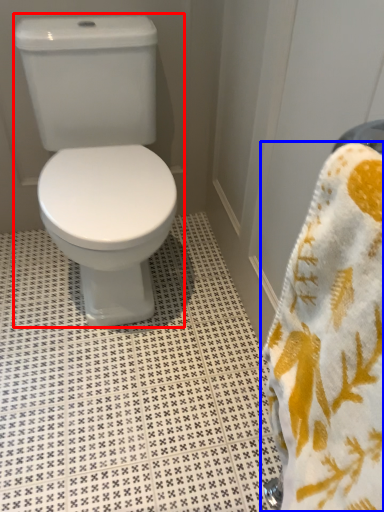
Question: Which point is further to the camera, toilet (highlighted by a red box) or towel (highlighted by a blue box)?

Choices:
 (A) toilet
 (B) towel

Answer: (A)